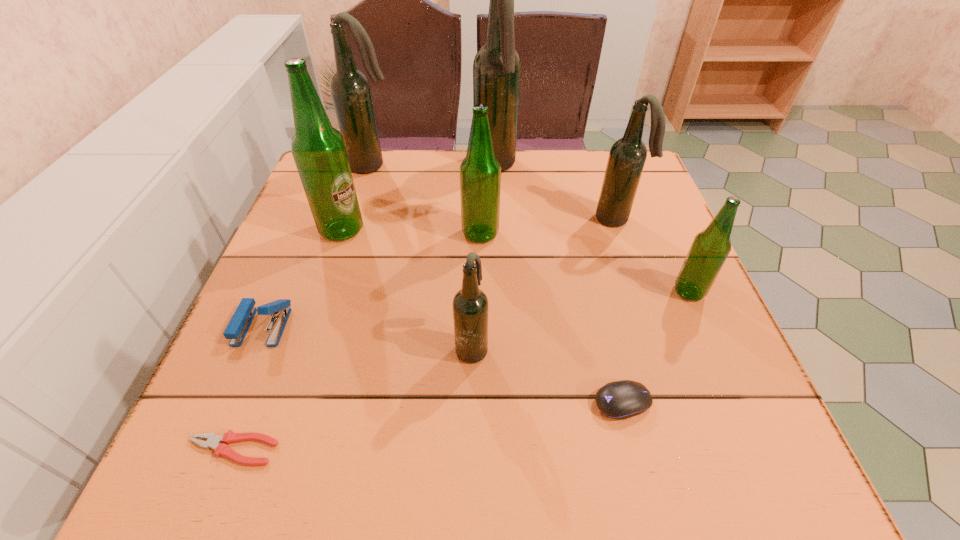
Select which object appears as the third closest to the pliers. Please provide its 2D coordinates. Your answer should be formatted as a tuple, i.e. [(x, y)], where the tuple contains the x and y coordinates of a point satisfying the conditions above.

[(318, 149)]

Point out which object is positioned as the fourth nearest to the third farthest dark beer bottle. Please provide its 2D coordinates. Your answer should be formatted as a tuple, i.e. [(x, y)], where the tuple contains the x and y coordinates of a point satisfying the conditions above.

[(470, 304)]

Where is `beer bottle that is the fourth closest to the biggest green beer bottle`? beer bottle that is the fourth closest to the biggest green beer bottle is located at coordinates (470, 304).

You are a GUI agent. You are given a task and a screenshot of the screen. Output one action in this format:
    pyautogui.click(x=<x>, y=<y>)
    Task: Click on the closest beer bottle relative to the leftmost dark beer bottle
    The height and width of the screenshot is (540, 960).
    Given the screenshot: What is the action you would take?
    pyautogui.click(x=318, y=149)

At what (x,y) coordinates should I click in order to perform the action: click on the closest dark beer bottle relative to the nearest beer bottle. Please return your answer as a coordinate pair (x, y). Looking at the image, I should click on (627, 157).

Identify which dark beer bottle is the nearest to the rightmost beer bottle. Please provide its 2D coordinates. Your answer should be formatted as a tuple, i.e. [(x, y)], where the tuple contains the x and y coordinates of a point satisfying the conditions above.

[(627, 157)]

This screenshot has height=540, width=960. Identify the location of green beer bottle that is the closest to the second beer bottle from right to left. (710, 248).

Identify the location of green beer bottle identified as the third closest to the tallest beer bottle. (710, 248).

Find the location of a particular element. This screenshot has height=540, width=960. blank area in the image that satisfies the following two spatial constraints: 1. on the label of the computer mouse; 2. on the right side of the leftmost green beer bottle is located at coordinates (284, 402).

Locate an element on the screen. vacant point that satisfies the following two spatial constraints: 1. on the label of the second smallest green beer bottle; 2. on the front side of the stapler is located at coordinates pos(480,326).